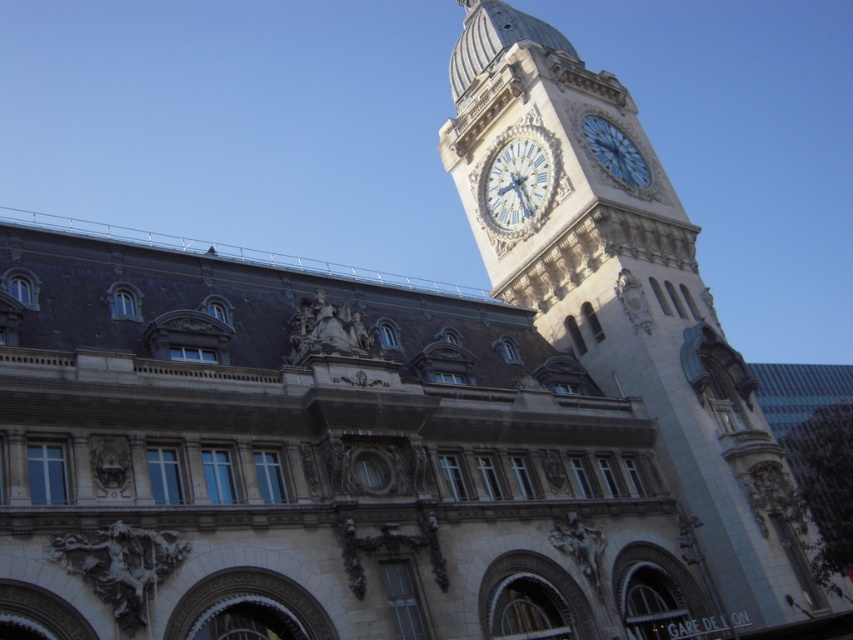
Question: Is the position of white marble clock at upper center more distant than that of blue glass clock at upper right?

Choices:
 (A) no
 (B) yes

Answer: (A)

Question: Considering the real-world distances, which object is closest to the white marble clock at upper center?

Choices:
 (A) blue glass clock at upper right
 (B) stone clock tower at upper right

Answer: (B)

Question: Based on their relative distances, which object is farther from the stone clock tower at upper right?

Choices:
 (A) white marble clock at upper center
 (B) blue glass clock at upper right

Answer: (B)

Question: Where is white marble clock at upper center located in relation to blue glass clock at upper right in the image?

Choices:
 (A) left
 (B) right

Answer: (A)

Question: Does stone clock tower at upper right lie behind blue glass clock at upper right?

Choices:
 (A) no
 (B) yes

Answer: (A)

Question: Among these objects, which one is nearest to the camera?

Choices:
 (A) blue glass clock at upper right
 (B) stone clock tower at upper right

Answer: (B)